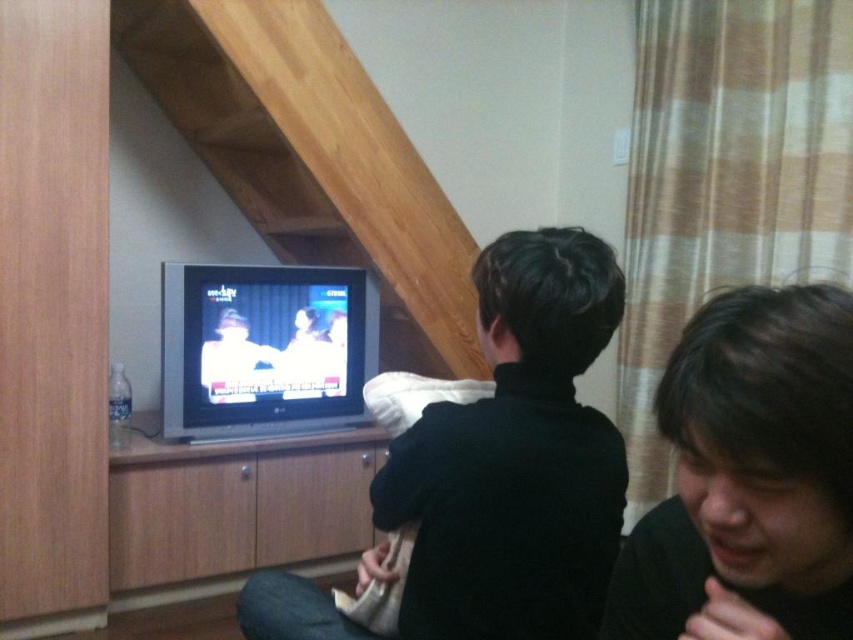
Question: Which point is closer to the camera?

Choices:
 (A) (741, 353)
 (B) (496, 572)

Answer: (A)

Question: Does black matte shirt at center have a lesser width compared to dark brown hair at lower right?

Choices:
 (A) no
 (B) yes

Answer: (A)

Question: Is black matte shirt at center closer to camera compared to dark brown hair at lower right?

Choices:
 (A) no
 (B) yes

Answer: (A)

Question: Is black matte shirt at center below dark brown hair at lower right?

Choices:
 (A) no
 (B) yes

Answer: (B)